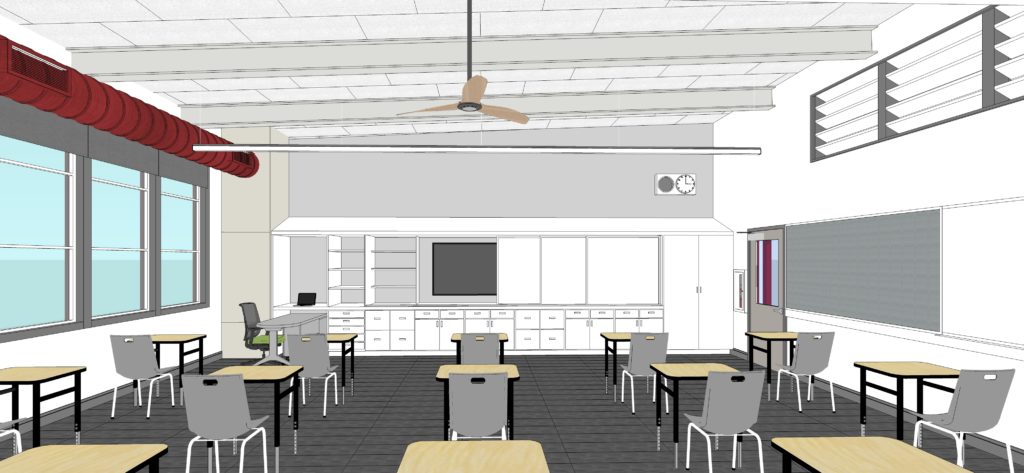
The height and width of the screenshot is (473, 1024). In order to click on air vents in this screenshot , I will do `click(852, 135)`, `click(830, 97)`, `click(921, 88)`, `click(933, 56)`.